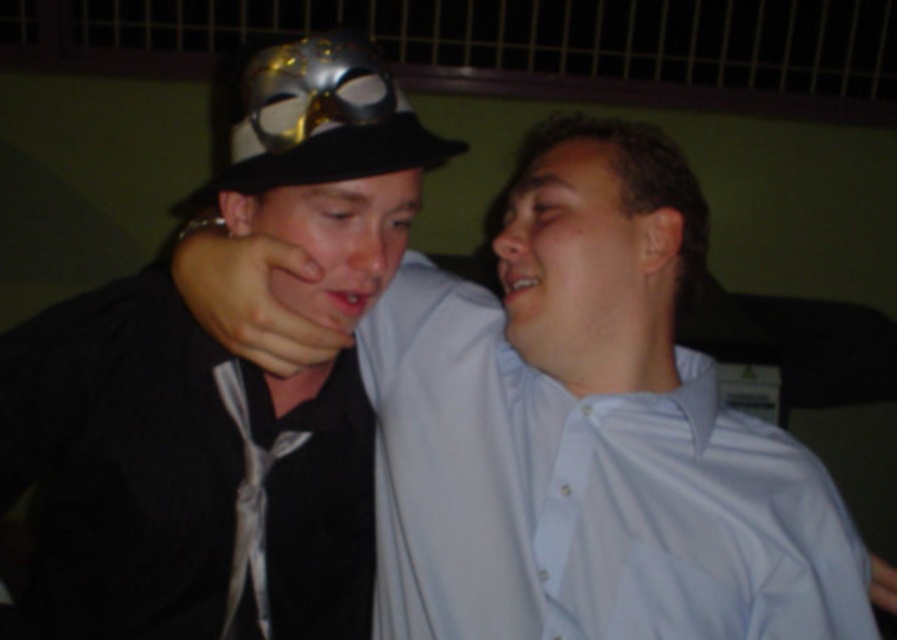
You are standing in front of the image and want to touch the point that is closer to you. Which point should you choose between point (614, 252) and point (371, 72)?

You should choose point (371, 72) because it is closer to you than point (614, 252).

You are a fashion designer analyzing the image. You need to determine which object is wider between the matte black shirt at center and the matte black face at center. Which one is wider?

The matte black shirt at center is wider than the matte black face at center according to the description provided.